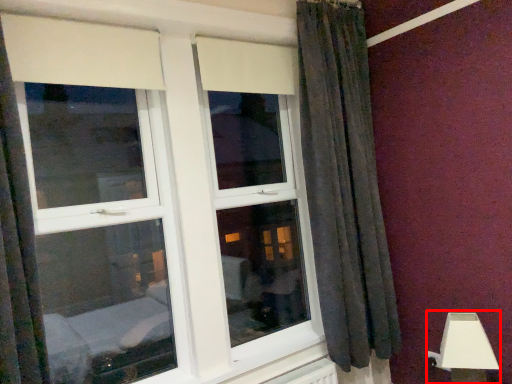
Question: From the image's perspective, where is table lamp (annotated by the red box) located in relation to window in the image?

Choices:
 (A) below
 (B) above

Answer: (A)